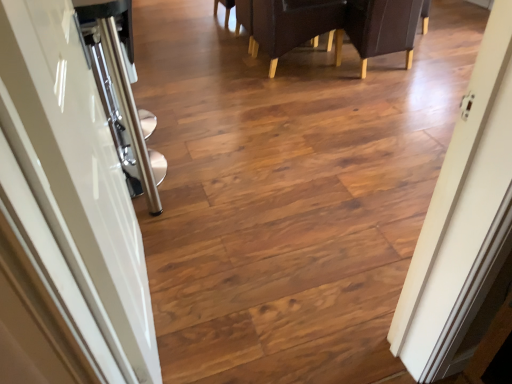
You are a GUI agent. You are given a task and a screenshot of the screen. Output one action in this format:
    pyautogui.click(x=<x>, y=<y>)
    Task: Click on the free space between leather-like dark brown chair at upper center and dark brown leather armchair at upper right, positioned as the first armchair in right-to-left order
    The image size is (512, 384).
    Given the screenshot: What is the action you would take?
    pyautogui.click(x=357, y=82)